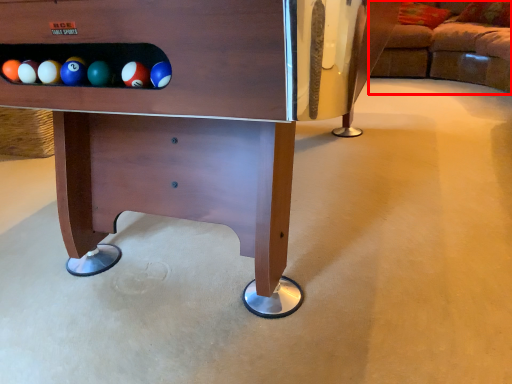
Question: Observing the image, what is the correct spatial positioning of studio couch (annotated by the red box) in reference to furniture?

Choices:
 (A) left
 (B) right

Answer: (B)